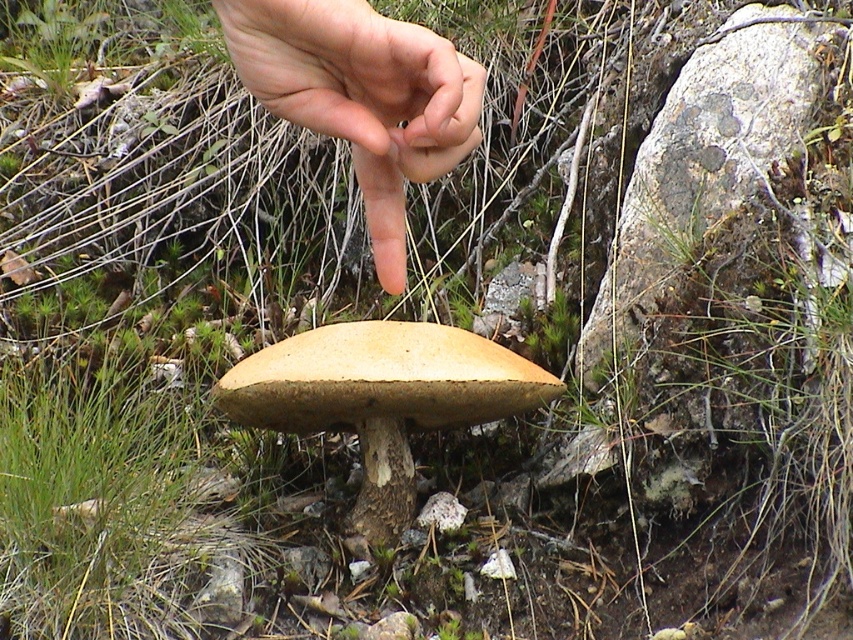
You are a mycologist examining a mushroom in a forest. You notice the skinny flesh at center and the light brown wood at center. Which object is smaller in size?

The skinny flesh at center is smaller in size compared to the light brown wood at center.

Consider the image. You are a mycologist examining a mushroom in a forest. You notice two parts of the mushroom labeled as skinny flesh at center and light brown wood at center. Which part is shorter?

The skinny flesh at center is shorter than the light brown wood at center.